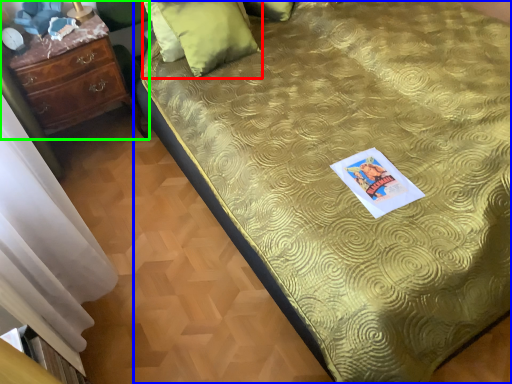
Question: Which is nearer to the pillow (highlighted by a red box)? bed (highlighted by a blue box) or chest of drawers (highlighted by a green box).

Choices:
 (A) bed
 (B) chest of drawers

Answer: (B)